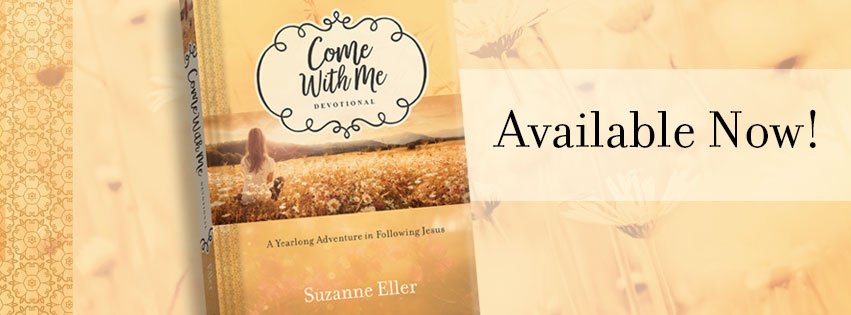
This screenshot has width=851, height=315. Find the location of `book display`. book display is located at coordinates (603, 221).